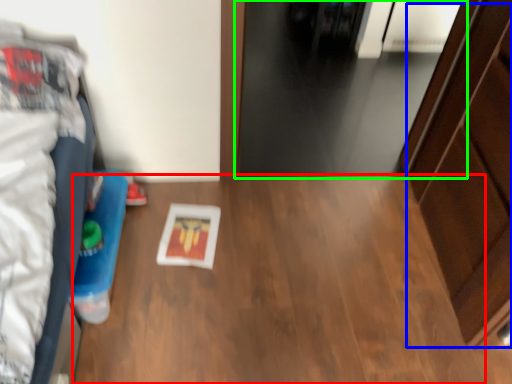
Question: Which object is positioned farthest from table (highlighted by a red box)? Select from dresser (highlighted by a blue box) and door (highlighted by a green box).

Choices:
 (A) dresser
 (B) door

Answer: (B)